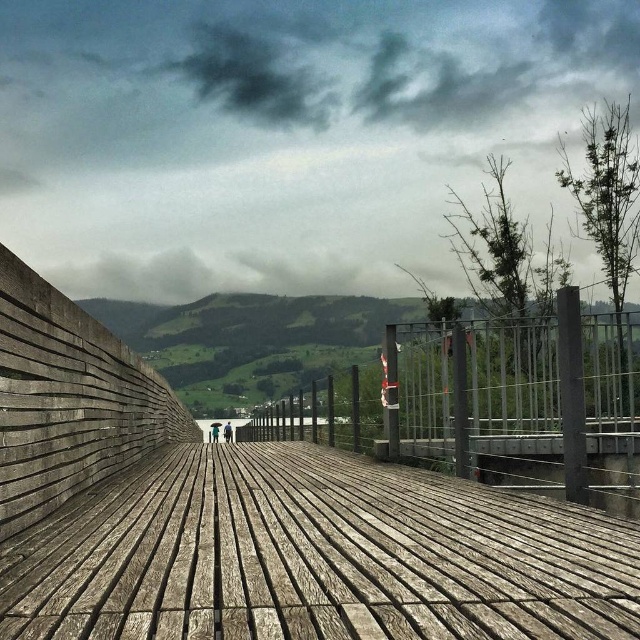
Question: Which point is farther from the camera taking this photo?

Choices:
 (A) (419, 568)
 (B) (429, 344)

Answer: (B)

Question: Does weathered wood dock at center have a greater width compared to metallic gray rail at center?

Choices:
 (A) yes
 (B) no

Answer: (B)

Question: Among these objects, which one is nearest to the camera?

Choices:
 (A) metallic gray rail at center
 (B) weathered wood dock at center

Answer: (B)

Question: Is weathered wood dock at center below metallic gray rail at center?

Choices:
 (A) no
 (B) yes

Answer: (A)

Question: Which of the following is the closest to the observer?

Choices:
 (A) (144, 611)
 (B) (388, 394)

Answer: (A)

Question: Is weathered wood dock at center wider than metallic gray rail at center?

Choices:
 (A) no
 (B) yes

Answer: (A)